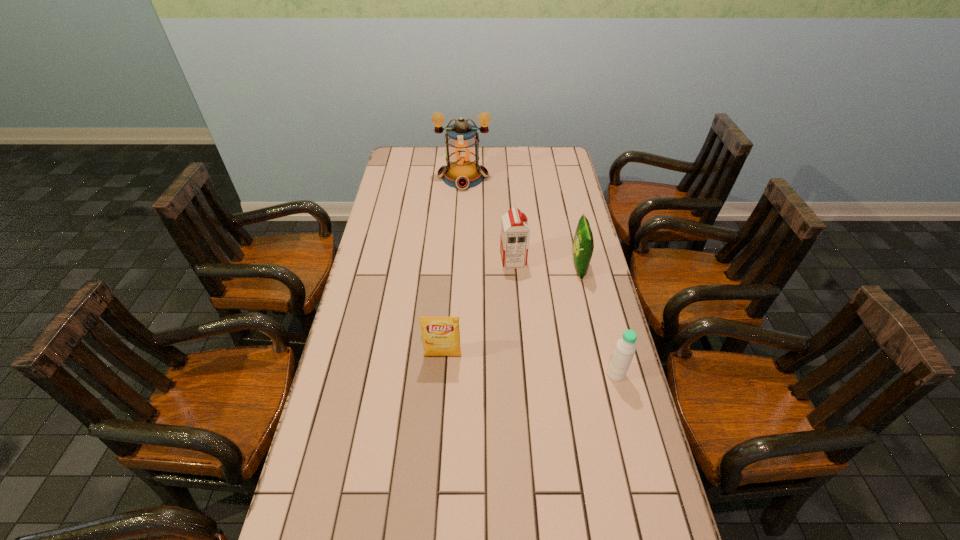
Where is `lantern`? This screenshot has width=960, height=540. lantern is located at coordinates (463, 171).

You are a GUI agent. You are given a task and a screenshot of the screen. Output one action in this format:
    pyautogui.click(x=<x>, y=<y>)
    Task: Click on the tallest object
    Image resolution: width=960 pixels, height=540 pixels.
    Given the screenshot: What is the action you would take?
    pyautogui.click(x=463, y=171)

The image size is (960, 540). I want to click on the third object from right to left, so click(x=515, y=232).

Find the location of a particular element. Image resolution: width=960 pixels, height=540 pixels. the right crisp (potato chip) is located at coordinates (583, 247).

This screenshot has height=540, width=960. In order to click on the nearest object in this screenshot , I will do `click(623, 353)`.

This screenshot has width=960, height=540. Identify the location of the left crisp (potato chip). (441, 335).

What are the coordinates of `the nearer crisp (potato chip)` in the screenshot? It's located at (441, 335).

Find the location of `vacant space located 0.080m on the front-facing side of the tallest object`. vacant space located 0.080m on the front-facing side of the tallest object is located at coordinates (462, 203).

Where is `free space located on the front of the third object from right to left`? The height and width of the screenshot is (540, 960). free space located on the front of the third object from right to left is located at coordinates tap(515, 284).

Locate an element on the screen. free space located on the front-facing side of the farther crisp (potato chip) is located at coordinates (471, 267).